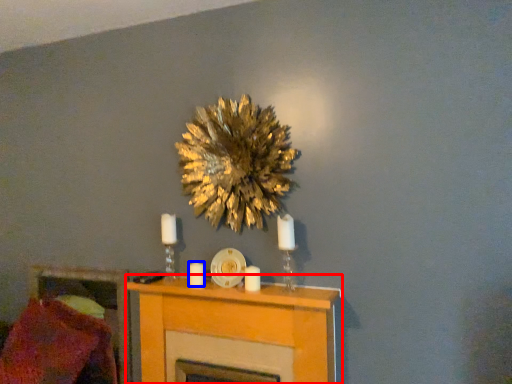
Question: Which object appears farthest to the camera in this image, furniture (highlighted by a red box) or candle (highlighted by a blue box)?

Choices:
 (A) furniture
 (B) candle

Answer: (B)